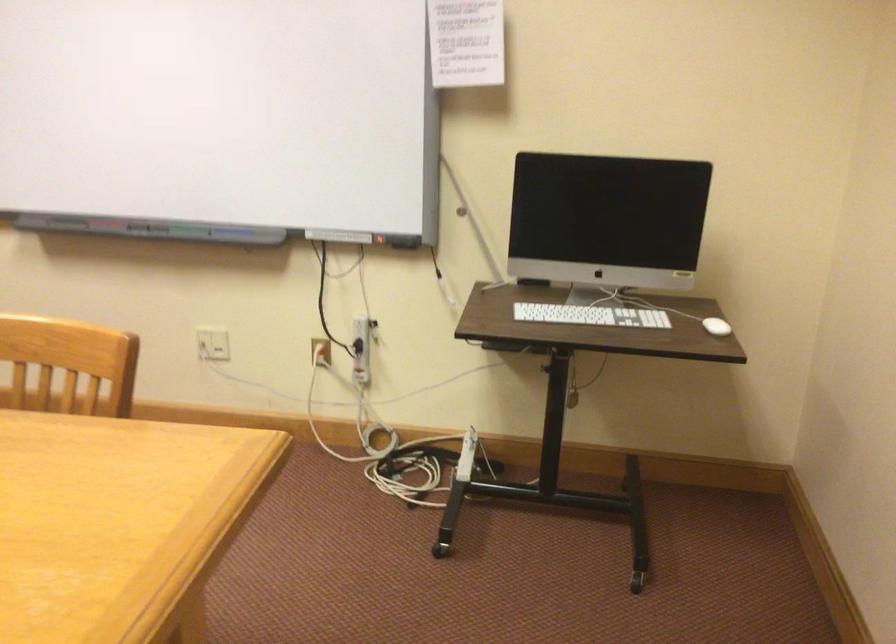
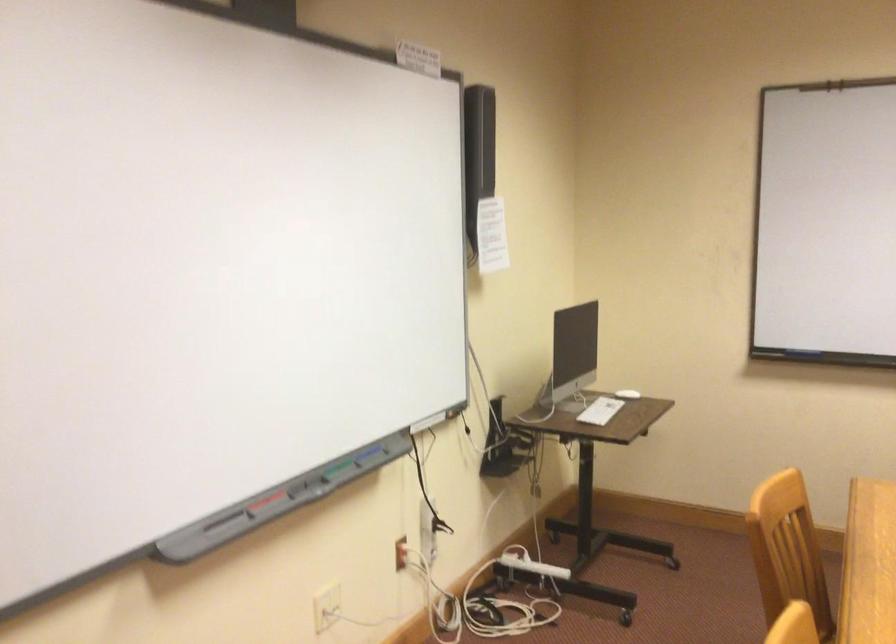
Where in the second image is the point corresponding to the point at 194,230 from the first image?

(333, 468)